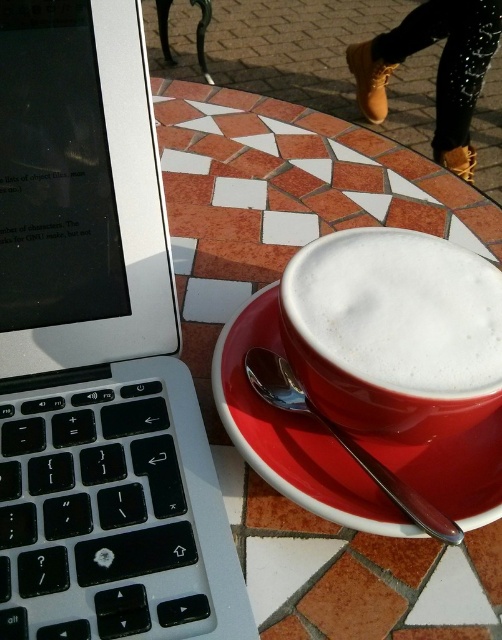
You are a barista trying to determine if the white frothy foam at center can fit entirely on the red ceramic saucer at center without spilling. Based on the spatial relationship between them, what should you consider?

The white frothy foam at center has a lesser width compared to the red ceramic saucer at center, so it can fit entirely on the saucer without spilling.

You are trying to place a small notebook between the silver metallic laptop at left and the white frothy foam at center on the table. Based on their sizes, will the notebook fit between them?

The silver metallic laptop at left is bigger than the white frothy foam at center, so there should be enough space between them to place the notebook.

You are a barista setting up a workspace. You need to place a laptop and a saucer on the table. The table has a round mosaic tile top. Given the current setup, can a 3.5 inch wide object be placed between the silver metallic laptop at left and the red ceramic saucer at center without moving them?

The distance between the silver metallic laptop at left and the red ceramic saucer at center is 2.73 inches. Since the object is 3.5 inches wide, which is wider than the gap, it cannot be placed between them without moving either the laptop or the saucer.